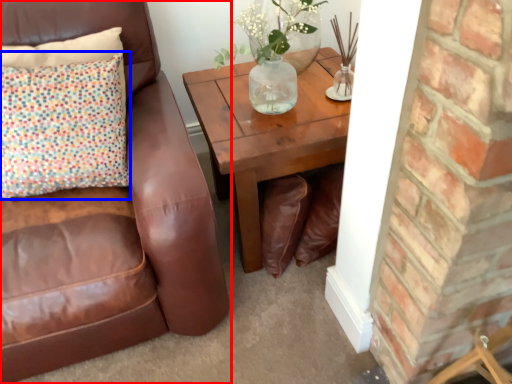
Question: Which object appears closest to the camera in this image, chair (highlighted by a red box) or pillow (highlighted by a blue box)?

Choices:
 (A) chair
 (B) pillow

Answer: (A)